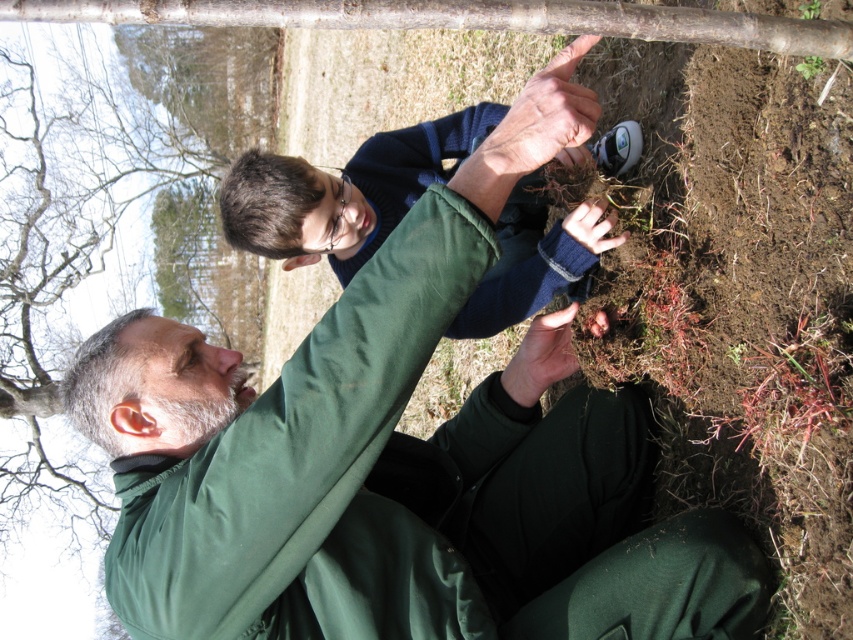
Does green matte tree at upper center come in front of dark blue sweater at upper center?

No, green matte tree at upper center is behind dark blue sweater at upper center.

This screenshot has width=853, height=640. Find the location of `green matte tree at upper center`. green matte tree at upper center is located at coordinates (123, 182).

Image resolution: width=853 pixels, height=640 pixels. Identify the location of green matte tree at upper center. (123, 182).

Does green matte jacket at center come behind dark blue sweater at upper center?

No, green matte jacket at center is closer to the viewer.

Does green matte jacket at center appear under dark blue sweater at upper center?

Yes.

Find the location of `green matte jacket at center`. green matte jacket at center is located at coordinates (393, 477).

Can you confirm if green matte jacket at center is taller than green matte tree at upper center?

In fact, green matte jacket at center may be shorter than green matte tree at upper center.

In the scene shown: Between green matte jacket at center and green matte tree at upper center, which one appears on the right side from the viewer's perspective?

From the viewer's perspective, green matte jacket at center appears more on the right side.

Who is more forward, (393, 269) or (105, 291)?

Point (393, 269) is more forward.

Where is `green matte jacket at center`? green matte jacket at center is located at coordinates (393, 477).